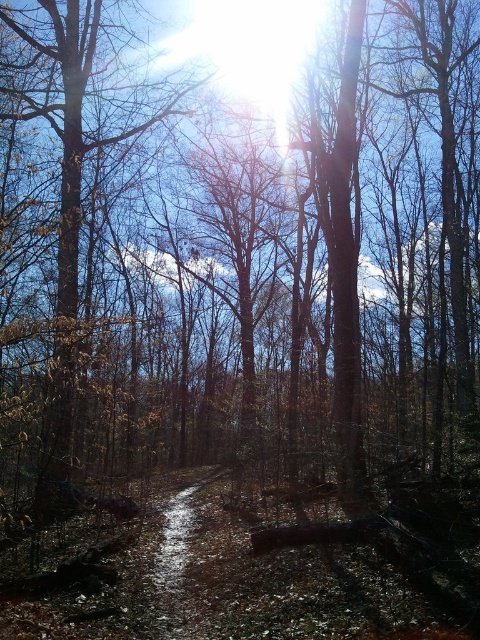
You are an adventurer trying to follow the damp dirt trail at center through the forest. There is a brown wood tree at center blocking your path. Which direction should you turn to avoid the tree and continue along the trail?

The brown wood tree at center is to the left of the damp dirt trail at center, so you should turn to the right to avoid the tree and continue along the trail.

You are standing on the forest path and see a point marked at coordinates (68, 211). What object does this point correspond to in the scene?

The point corresponds to the brown wood tree at center.